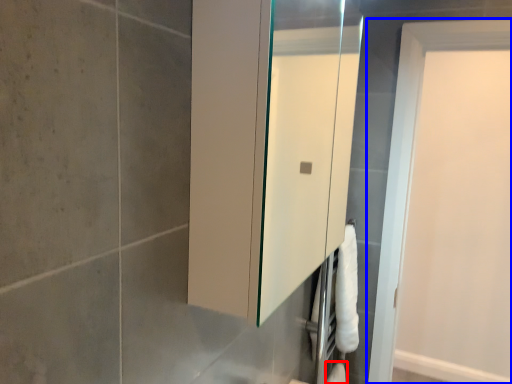
Question: Which object is closer to the camera taking this photo, toilet paper (highlighted by a red box) or door (highlighted by a blue box)?

Choices:
 (A) toilet paper
 (B) door

Answer: (B)